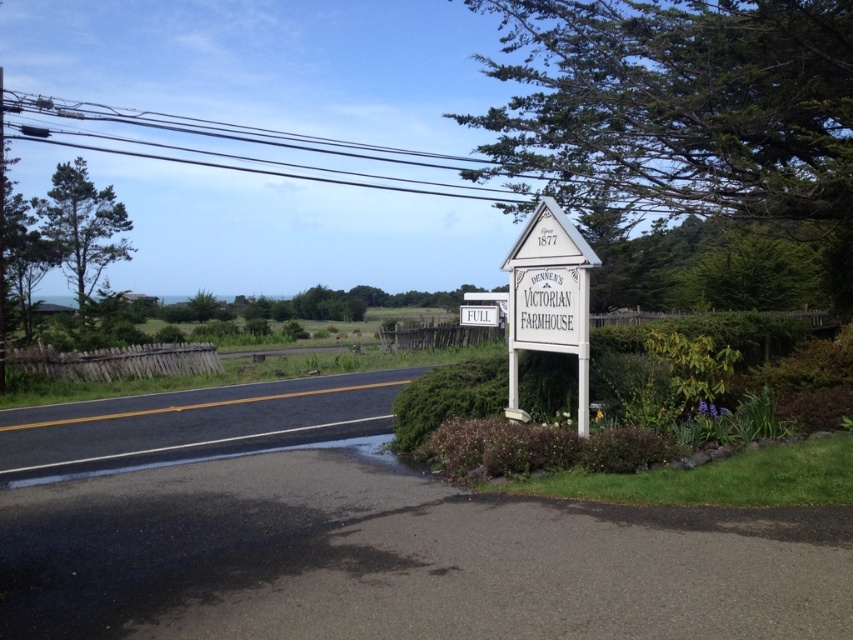
You are a tourist driving along the road and see the white wooden sign at center and the white matte sign at center. According to their positions, which sign should you look at first if you want to read both signs as you approach them?

The white wooden sign at center is to the right of the white matte sign at center, so as you approach them, you should look at the white matte sign at center first since it is on the left side.

You are a tourist driving along the road and see the white wooden sign at center and the white matte sign at center. Which one do you need to look at first as you approach them?

The white wooden sign at center is closer to the viewer than the white matte sign at center, so you should look at the white wooden sign at center first as you approach them.

You are standing at the point labeled point (466, 320) and want to walk towards the farmhouse sign. Which direction should you move relative to point (511, 387)?

You should move towards point (511, 387) because it is closer to the viewer, so moving in that direction will bring you closer to the farmhouse sign.